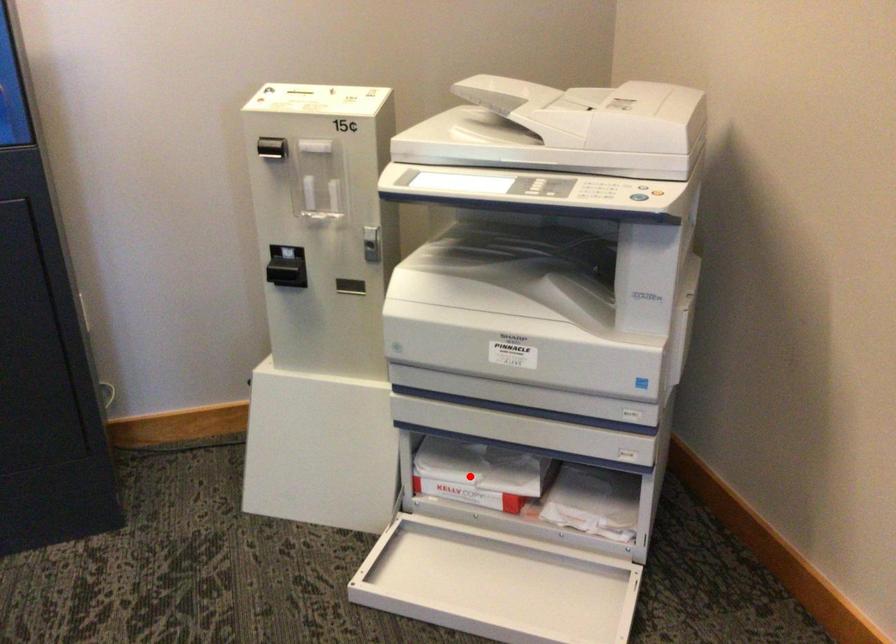
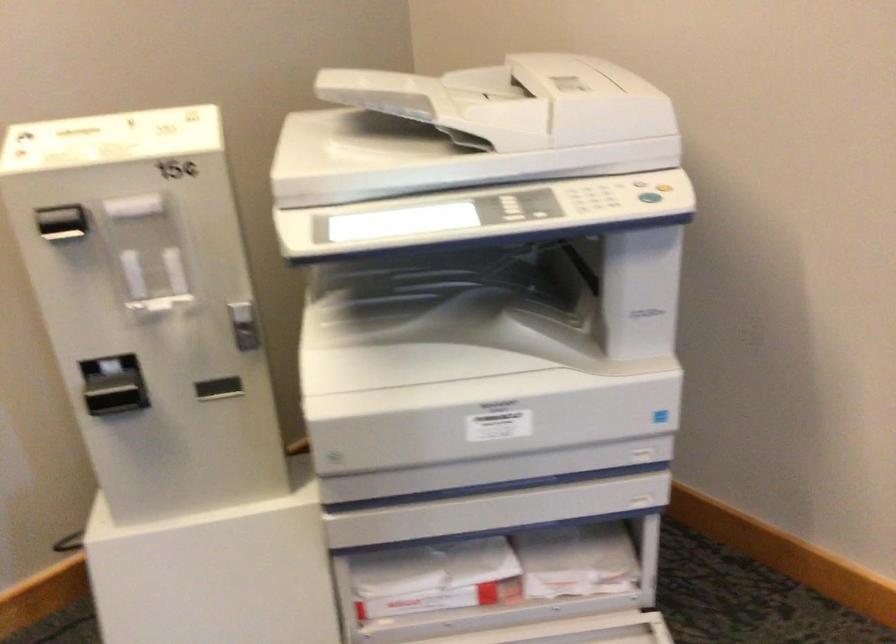
In the second image, find the point that corresponds to the highlighted location in the first image.

(435, 576)